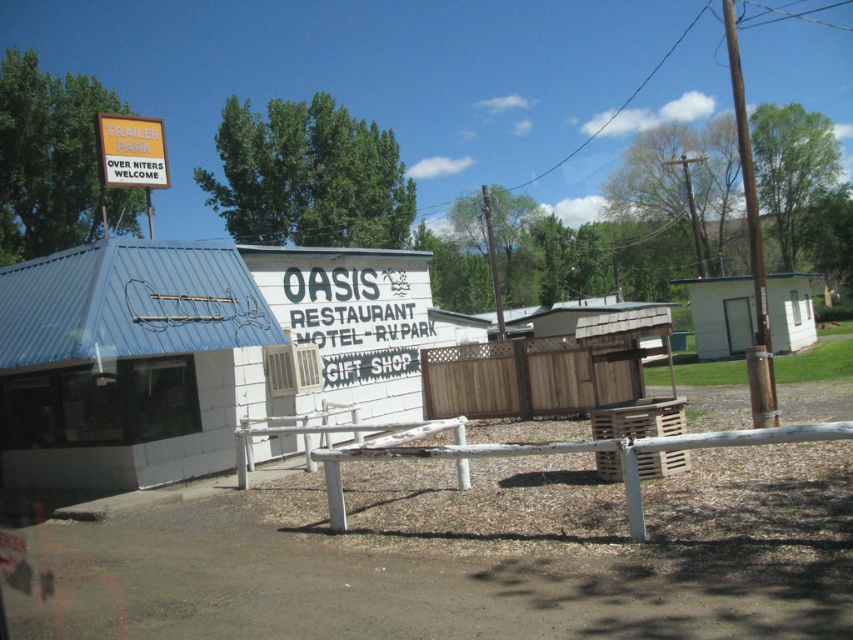
Question: Is white wood fence at center closer to camera compared to yellow plastic sign at upper left?

Choices:
 (A) no
 (B) yes

Answer: (B)

Question: Does white wood fence at center come in front of yellow plastic sign at upper left?

Choices:
 (A) no
 (B) yes

Answer: (B)

Question: Can you confirm if brown wood fence at center is positioned below yellow plastic sign at upper left?

Choices:
 (A) yes
 (B) no

Answer: (A)

Question: Which point is farther to the camera?

Choices:
 (A) (163, 154)
 (B) (306, 456)

Answer: (A)

Question: Which object is positioned closest to the brown wood fence at center?

Choices:
 (A) yellow plastic sign at upper left
 (B) white wood fence at center

Answer: (B)

Question: Which point is farther from the camera taking this photo?

Choices:
 (A) (131, 134)
 (B) (345, 452)
 (C) (527, 403)

Answer: (C)